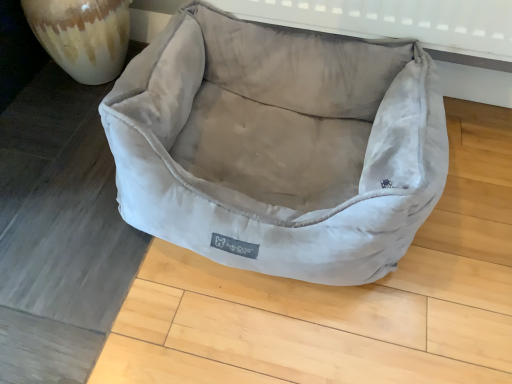
This screenshot has height=384, width=512. Describe the element at coordinates (82, 35) in the screenshot. I see `marbled ceramic vase at left` at that location.

At what (x,y) coordinates should I click in order to perform the action: click on marbled ceramic vase at left. Please return your answer as a coordinate pair (x, y). Looking at the image, I should click on (82, 35).

Image resolution: width=512 pixels, height=384 pixels. In order to click on suede-like beige dog bed at center in this screenshot , I will do `click(278, 146)`.

The height and width of the screenshot is (384, 512). What do you see at coordinates (278, 146) in the screenshot?
I see `suede-like beige dog bed at center` at bounding box center [278, 146].

Image resolution: width=512 pixels, height=384 pixels. Identify the location of marbled ceramic vase at left. (82, 35).

In the scene shown: Which is more to the left, suede-like beige dog bed at center or marbled ceramic vase at left?

From the viewer's perspective, marbled ceramic vase at left appears more on the left side.

Is the position of suede-like beige dog bed at center more distant than that of marbled ceramic vase at left?

No, it is not.

Does point (372, 100) come in front of point (94, 32)?

Yes, it is in front of point (94, 32).

From the image's perspective, is suede-like beige dog bed at center beneath marbled ceramic vase at left?

Yes, from the image's perspective, suede-like beige dog bed at center is below marbled ceramic vase at left.

From a real-world perspective, who is located higher, suede-like beige dog bed at center or marbled ceramic vase at left?

From a 3D spatial view, suede-like beige dog bed at center is above.

Between suede-like beige dog bed at center and marbled ceramic vase at left, which one has larger width?

With larger width is suede-like beige dog bed at center.

Who is taller, suede-like beige dog bed at center or marbled ceramic vase at left?

suede-like beige dog bed at center is taller.

Who is bigger, suede-like beige dog bed at center or marbled ceramic vase at left?

Bigger between the two is suede-like beige dog bed at center.

Is suede-like beige dog bed at center situated inside marbled ceramic vase at left or outside?

suede-like beige dog bed at center is spatially situated outside marbled ceramic vase at left.

In the scene shown: Is the surface of suede-like beige dog bed at center in direct contact with marbled ceramic vase at left?

suede-like beige dog bed at center and marbled ceramic vase at left are clearly separated.

Is suede-like beige dog bed at center facing away from marbled ceramic vase at left?

No, suede-like beige dog bed at center is not facing away from marbled ceramic vase at left.

What's the angular difference between suede-like beige dog bed at center and marbled ceramic vase at left's facing directions?

They differ by 0.000526 degrees in their facing directions.

How distant is suede-like beige dog bed at center from marbled ceramic vase at left?

suede-like beige dog bed at center is 40.77 centimeters from marbled ceramic vase at left.

The image size is (512, 384). I want to click on dog bed in front of the marbled ceramic vase at left, so click(x=278, y=146).

Is marbled ceramic vase at left to the left or to the right of suede-like beige dog bed at center in the image?

From the image, it's evident that marbled ceramic vase at left is to the left of suede-like beige dog bed at center.

In the image, is marbled ceramic vase at left positioned in front of or behind suede-like beige dog bed at center?

marbled ceramic vase at left is behind suede-like beige dog bed at center.

Is point (79, 72) more distant than point (203, 210)?

Yes, point (79, 72) is behind point (203, 210).

From the image's perspective, relative to suede-like beige dog bed at center, is marbled ceramic vase at left above or below?

marbled ceramic vase at left is situated higher than suede-like beige dog bed at center in the image.

From a real-world perspective, is marbled ceramic vase at left physically above suede-like beige dog bed at center?

Actually, marbled ceramic vase at left is physically below suede-like beige dog bed at center in the real world.

Considering the relative sizes of marbled ceramic vase at left and suede-like beige dog bed at center in the image provided, is marbled ceramic vase at left thinner than suede-like beige dog bed at center?

Correct, the width of marbled ceramic vase at left is less than that of suede-like beige dog bed at center.

Is marbled ceramic vase at left shorter than suede-like beige dog bed at center?

Yes, marbled ceramic vase at left is shorter than suede-like beige dog bed at center.

In the scene shown: Based on their sizes in the image, would you say marbled ceramic vase at left is bigger or smaller than suede-like beige dog bed at center?

marbled ceramic vase at left is smaller than suede-like beige dog bed at center.

Is marbled ceramic vase at left not within suede-like beige dog bed at center?

marbled ceramic vase at left is positioned outside suede-like beige dog bed at center.

Is marbled ceramic vase at left next to suede-like beige dog bed at center?

No.

Could you tell me if marbled ceramic vase at left is facing suede-like beige dog bed at center?

No, marbled ceramic vase at left is not turned towards suede-like beige dog bed at center.

What's the angular difference between marbled ceramic vase at left and suede-like beige dog bed at center's facing directions?

They differ by 0.000526 degrees in their facing directions.

Find the location of a particular element. dog bed below the marbled ceramic vase at left (from the image's perspective) is located at coordinates (278, 146).

Locate an element on the screen. The width and height of the screenshot is (512, 384). dog bed that appears above the marbled ceramic vase at left (from a real-world perspective) is located at coordinates (278, 146).

At what (x,y) coordinates should I click in order to perform the action: click on dog bed that appears on the right of marbled ceramic vase at left. Please return your answer as a coordinate pair (x, y). Image resolution: width=512 pixels, height=384 pixels. Looking at the image, I should click on (278, 146).